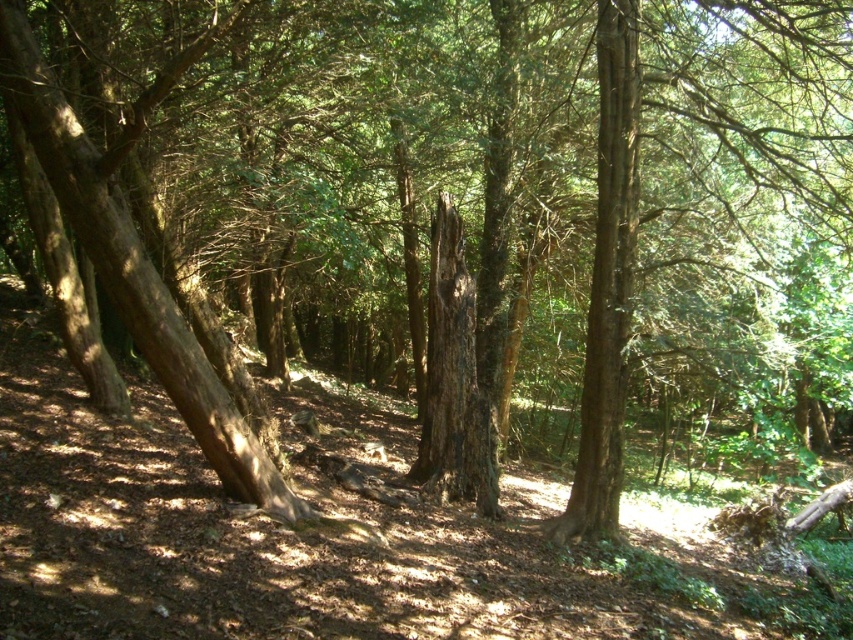
You are a hiker walking through the forest and want to take a photo of the brown rough tree trunk at left and the brown rough bark tree trunk at center. Which tree trunk should you stand closer to in order to capture both in the same frame?

You should stand closer to the brown rough tree trunk at left because it is positioned under the brown rough bark tree trunk at center, so moving closer to the lower one will help include both in the frame.